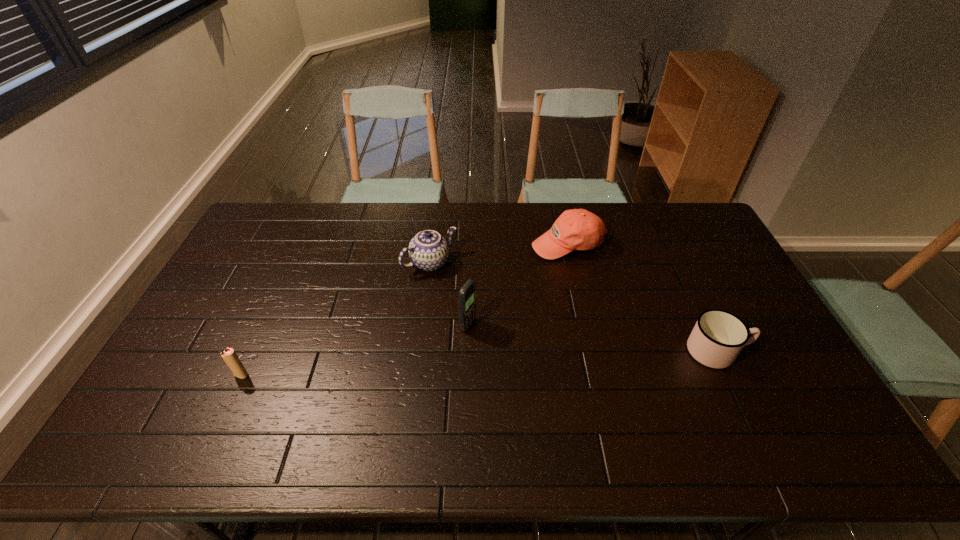
This screenshot has height=540, width=960. What are the coordinates of `igniter` in the screenshot? It's located at (229, 356).

Locate an element on the screen. the rightmost object is located at coordinates (718, 336).

In order to click on cellular telephone in this screenshot , I will do 467,295.

Find the location of `the tallest object`. the tallest object is located at coordinates (467, 295).

At what (x,y) coordinates should I click in order to perform the action: click on chinaware. Please return your answer as a coordinate pair (x, y). Looking at the image, I should click on (428, 250).

Locate an element on the screen. baseball cap is located at coordinates (577, 229).

Locate an element on the screen. vacant space situated on the left of the leftmost object is located at coordinates (200, 375).

Where is `free spot located on the side of the mug with the handle`? free spot located on the side of the mug with the handle is located at coordinates (786, 351).

Locate an element on the screen. Image resolution: width=960 pixels, height=540 pixels. vacant point located on the screen of the cellular telephone is located at coordinates (503, 342).

Locate an element on the screen. vacant area located on the screen of the cellular telephone is located at coordinates (499, 340).